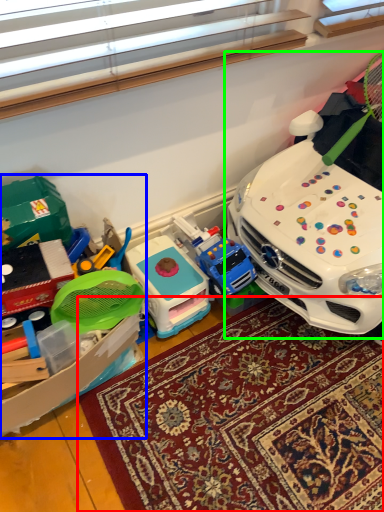
Question: Estimate the real-world distances between objects in this image. Which object is closer to mat (highlighted by a red box), toy (highlighted by a blue box) or toy (highlighted by a green box)?

Choices:
 (A) toy
 (B) toy

Answer: (A)